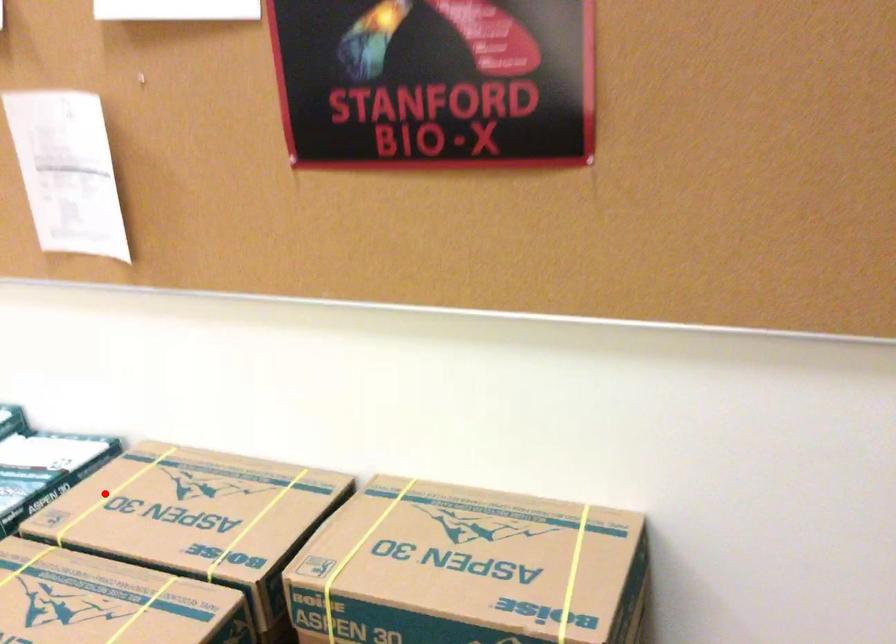
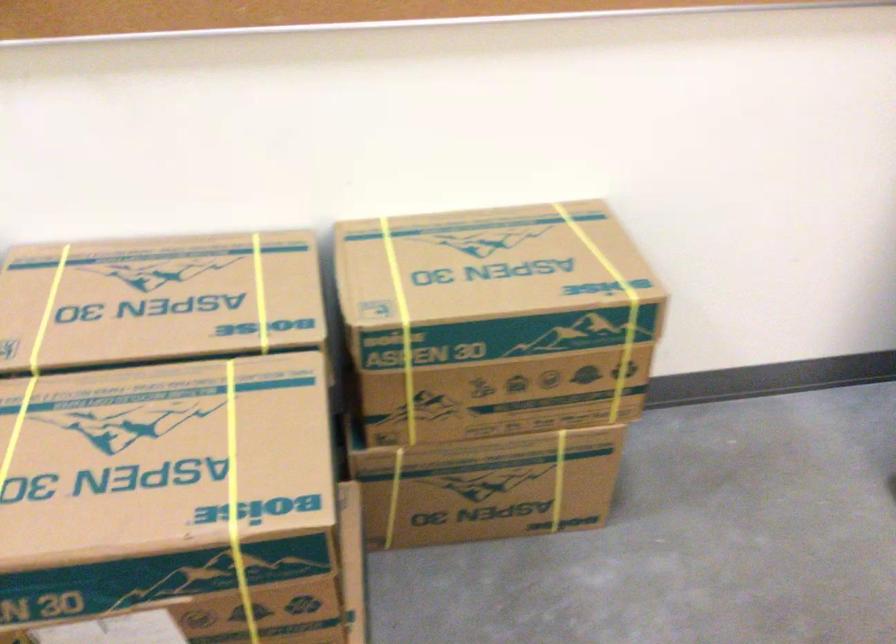
In the second image, find the point that corresponds to the highlighted location in the first image.

(47, 310)